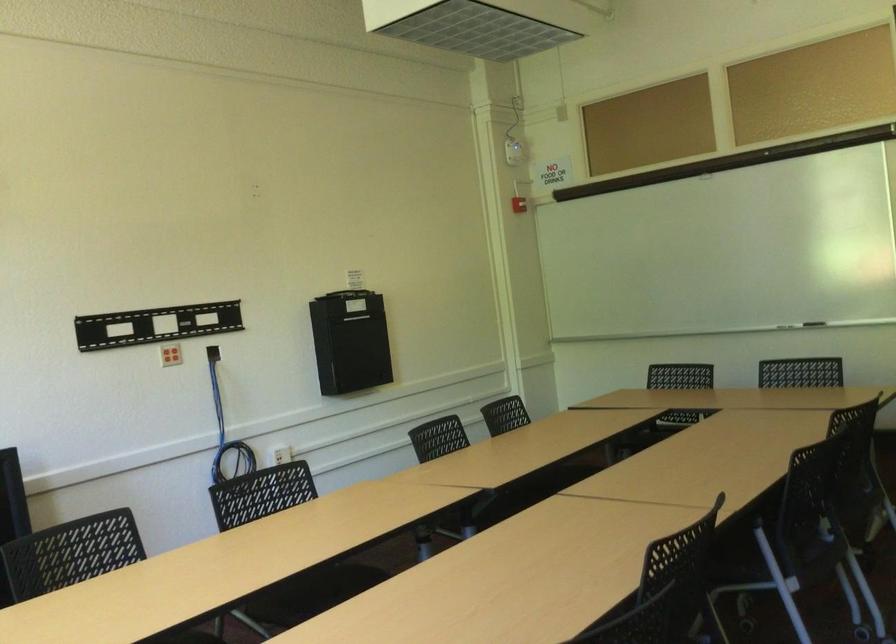
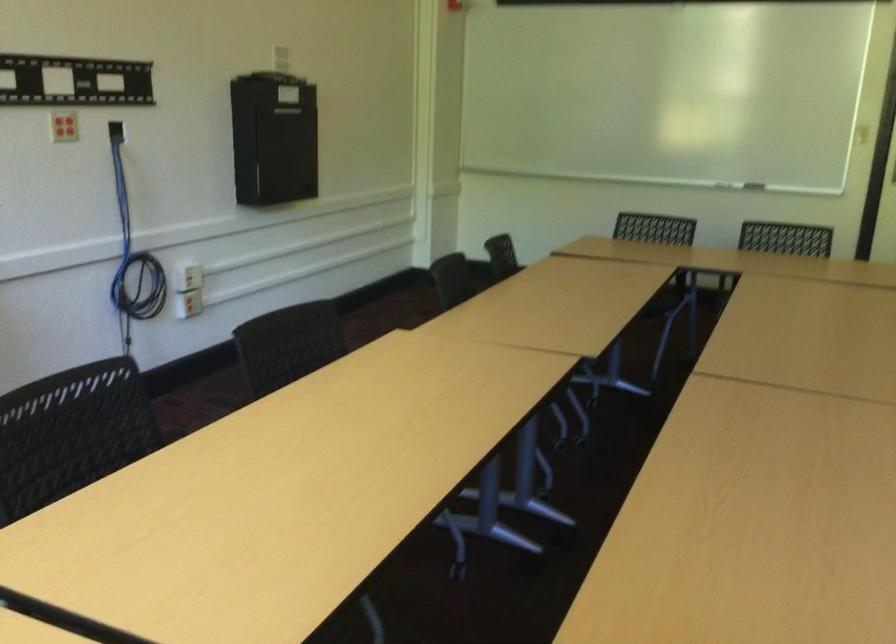
Locate, in the second image, the point that corresponds to pixel 228 442 in the first image.

(133, 252)